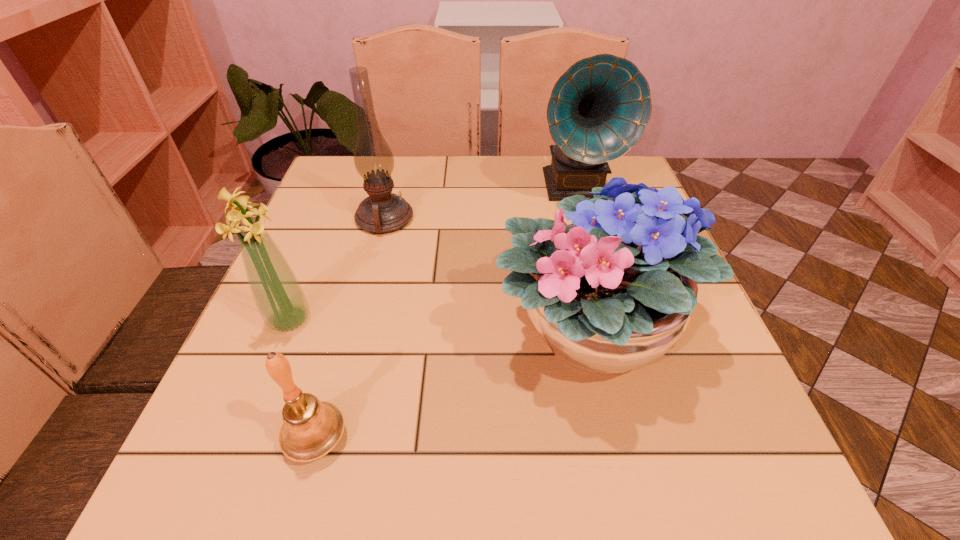
This screenshot has width=960, height=540. I want to click on phonograph_record, so click(599, 108).

Find the location of a particular element. This screenshot has width=960, height=540. oil lamp is located at coordinates (382, 212).

Find the location of `the left bouquet`. the left bouquet is located at coordinates (279, 297).

Image resolution: width=960 pixels, height=540 pixels. What are the coordinates of `the right bouquet` in the screenshot? It's located at (606, 296).

Locate an element on the screen. bell is located at coordinates (311, 428).

Where is `free region located from the horn of the phonograph_record`? The width and height of the screenshot is (960, 540). free region located from the horn of the phonograph_record is located at coordinates (604, 285).

Find the location of a particular element. This screenshot has height=540, width=960. vacant space located on the right of the oil lamp is located at coordinates (527, 218).

Where is `free space located on the front-facing side of the leftmost object`? free space located on the front-facing side of the leftmost object is located at coordinates (472, 320).

What are the coordinates of `vacant space located on the left of the right bouquet` in the screenshot? It's located at (x=439, y=333).

Where is `free space located 0.370m on the back of the shortest object`? free space located 0.370m on the back of the shortest object is located at coordinates (367, 258).